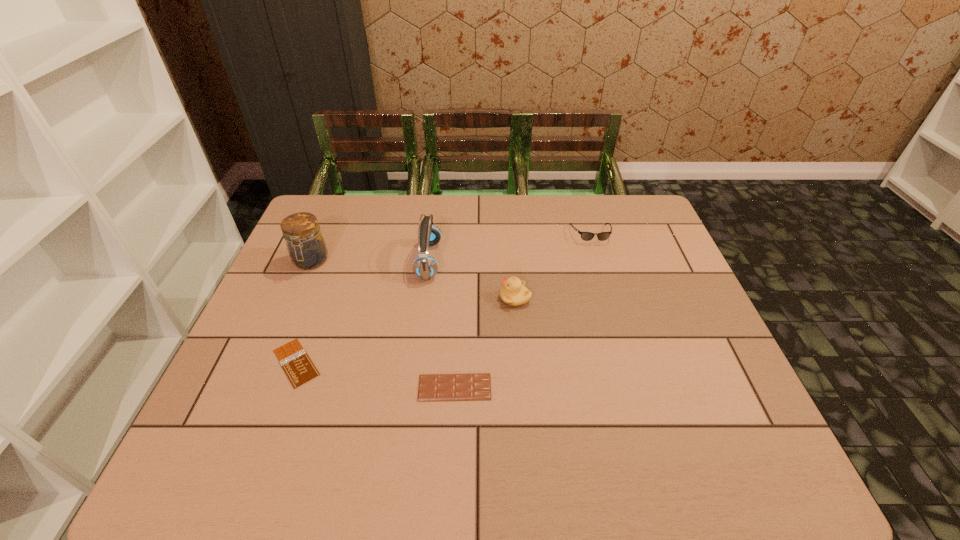
Locate an element on the screen. This screenshot has width=960, height=540. chocolate bar that is at the left edge is located at coordinates (297, 365).

This screenshot has height=540, width=960. I want to click on vacant space at the far edge of the desktop, so click(575, 232).

In the image, there is a desktop. Identify the location of vacant space at the near edge. Image resolution: width=960 pixels, height=540 pixels. (356, 447).

The image size is (960, 540). What are the coordinates of `free space at the left edge of the desktop` in the screenshot? It's located at [209, 414].

Image resolution: width=960 pixels, height=540 pixels. Find the location of `vacant space at the near left corner`. vacant space at the near left corner is located at coordinates (267, 460).

The width and height of the screenshot is (960, 540). What are the coordinates of `free space at the far right corner` in the screenshot? It's located at (629, 218).

Image resolution: width=960 pixels, height=540 pixels. In the image, there is a desktop. Find the location of `vacant space at the near right corner`. vacant space at the near right corner is located at coordinates (710, 450).

Find the location of a particular element. This screenshot has width=960, height=540. free space between the right chocolate bar and the left chocolate bar is located at coordinates (375, 375).

Image resolution: width=960 pixels, height=540 pixels. I want to click on vacant space that is in between the headset and the shortest object, so click(363, 312).

Locate an element on the screen. unoccupied position between the fourth tallest object and the jar is located at coordinates (450, 248).